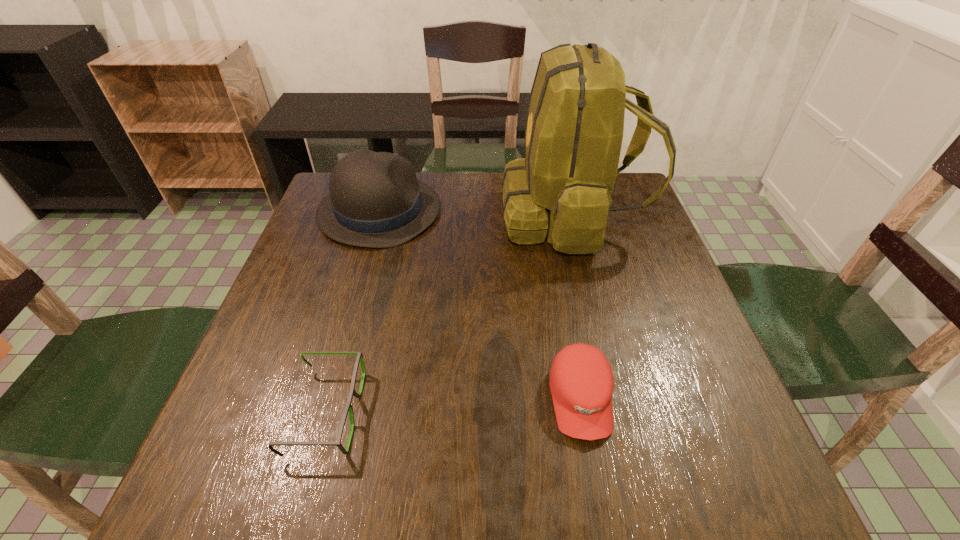
Where is `free spot that satisfies the following two spatial constraints: 1. on the front-facing side of the cap; 2. on the lens of the spectacles`? This screenshot has width=960, height=540. free spot that satisfies the following two spatial constraints: 1. on the front-facing side of the cap; 2. on the lens of the spectacles is located at coordinates (583, 412).